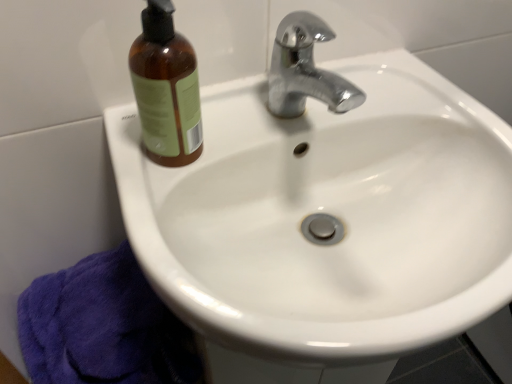
Question: From a real-world perspective, is purple terry cloth towel at lower left above or below brown glass bottle at upper left?

Choices:
 (A) below
 (B) above

Answer: (A)

Question: Is point (154, 375) closer or farther from the camera than point (150, 6)?

Choices:
 (A) farther
 (B) closer

Answer: (A)

Question: Is purple terry cloth towel at lower left situated inside brown glass bottle at upper left or outside?

Choices:
 (A) inside
 (B) outside

Answer: (B)

Question: Considering the positions of brown glass bottle at upper left and purple terry cloth towel at lower left in the image, is brown glass bottle at upper left bigger or smaller than purple terry cloth towel at lower left?

Choices:
 (A) big
 (B) small

Answer: (B)

Question: Would you say brown glass bottle at upper left is to the left or to the right of purple terry cloth towel at lower left in the picture?

Choices:
 (A) right
 (B) left

Answer: (A)

Question: From a real-world perspective, is brown glass bottle at upper left above or below purple terry cloth towel at lower left?

Choices:
 (A) below
 (B) above

Answer: (B)

Question: Is brown glass bottle at upper left taller or shorter than purple terry cloth towel at lower left?

Choices:
 (A) short
 (B) tall

Answer: (A)